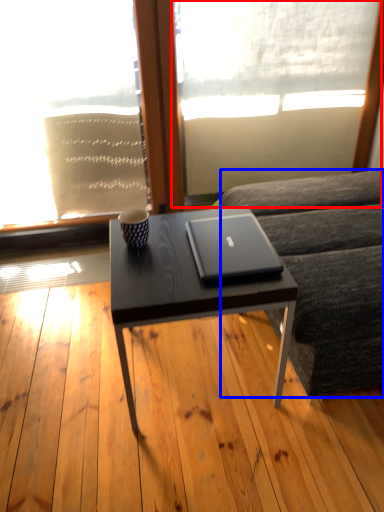
Question: Which object is further to the camera taking this photo, window screen (highlighted by a red box) or studio couch (highlighted by a blue box)?

Choices:
 (A) window screen
 (B) studio couch

Answer: (A)